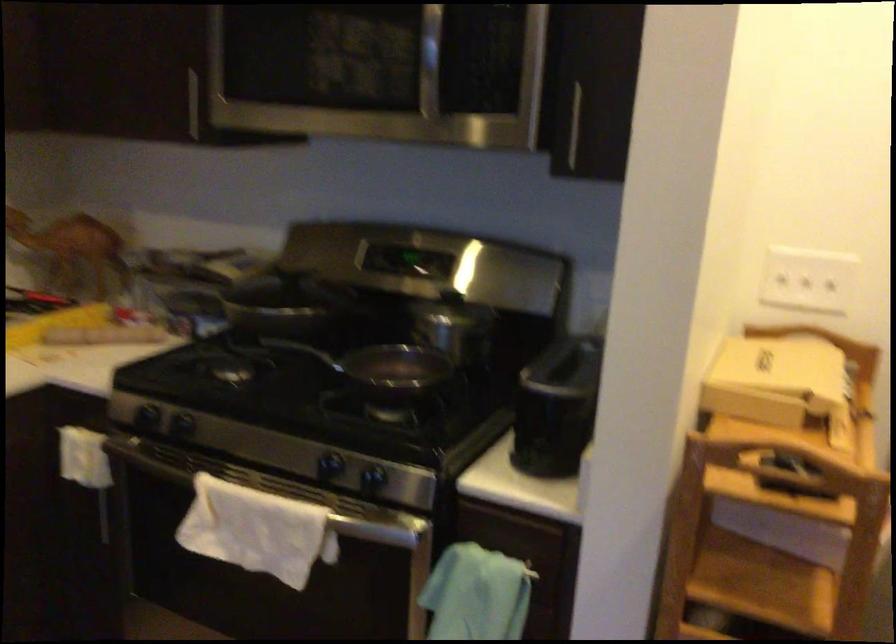
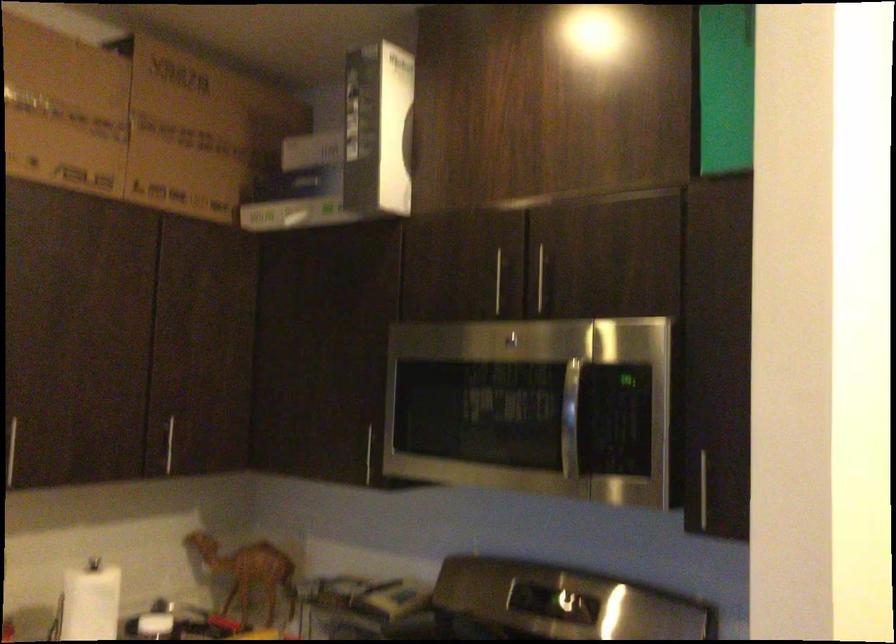
The point at [191,90] is marked in the first image. Where is the corresponding point in the second image?

(364, 440)